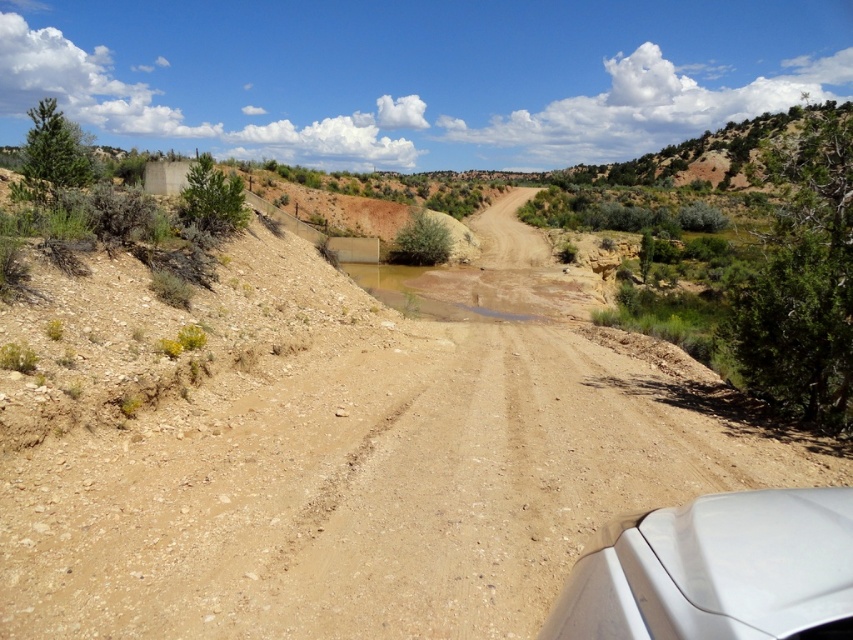
Does brown sandy dirt at center lie behind brown sandy puddle at center?

That is False.

Where is `brown sandy dirt at center`? brown sandy dirt at center is located at coordinates (331, 460).

You are a GUI agent. You are given a task and a screenshot of the screen. Output one action in this format:
    pyautogui.click(x=<x>, y=<y>)
    Task: Click on the brown sandy dirt at center
    The height and width of the screenshot is (640, 853).
    Given the screenshot: What is the action you would take?
    pyautogui.click(x=331, y=460)

Is white matte car at lower right to the left of brown sandy puddle at center from the viewer's perspective?

Indeed, white matte car at lower right is positioned on the left side of brown sandy puddle at center.

Can you confirm if white matte car at lower right is shorter than brown sandy puddle at center?

Correct, white matte car at lower right is not as tall as brown sandy puddle at center.

Does point (668, 563) come farther from viewer compared to point (514, 280)?

No, (668, 563) is closer to viewer.

The width and height of the screenshot is (853, 640). What are the coordinates of `white matte car at lower right` in the screenshot? It's located at (717, 570).

Who is positioned more to the right, brown sandy dirt at center or white matte car at lower right?

Result: white matte car at lower right

Where is `brown sandy dirt at center`? This screenshot has width=853, height=640. brown sandy dirt at center is located at coordinates (x=331, y=460).